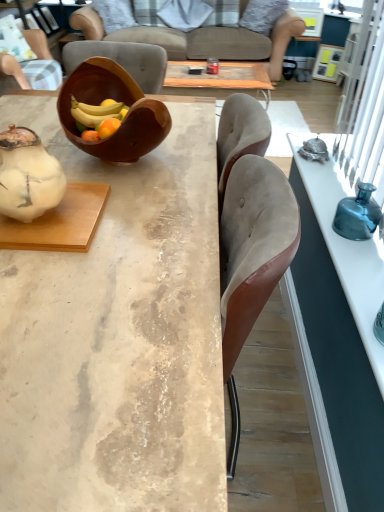
This screenshot has height=512, width=384. Identify the location of vacant space in front of blue glass bottle at right. (359, 258).